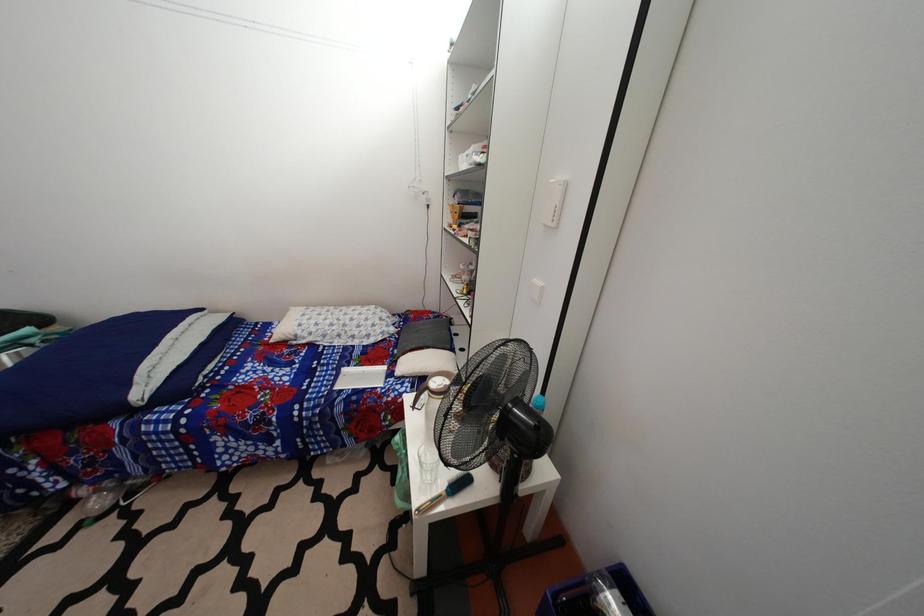
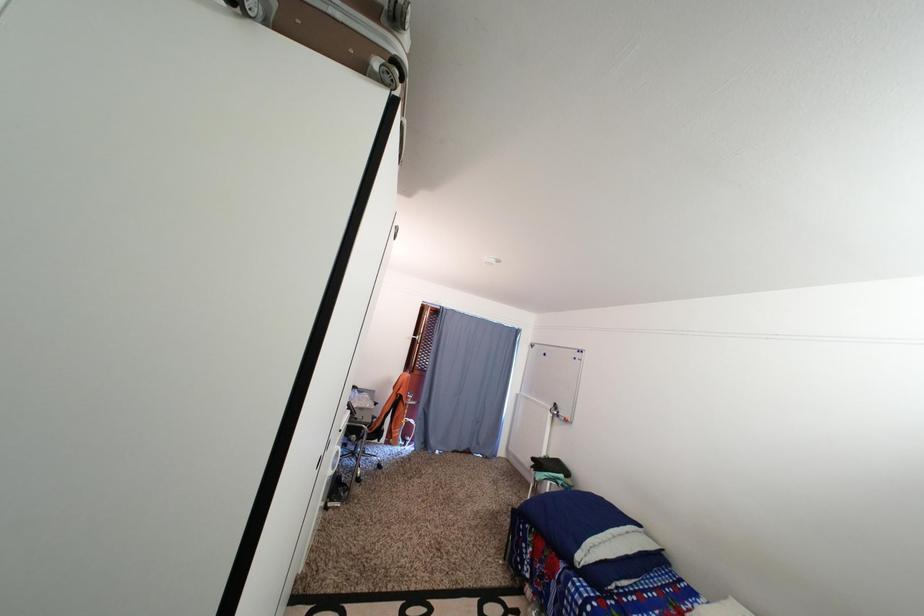
Question: The camera is either moving clockwise (left) or counter-clockwise (right) around the object. The first image is from the beginning of the video and the second image is from the end. Is the camera moving left or right when shooting the video?

Choices:
 (A) Left
 (B) Right

Answer: (B)